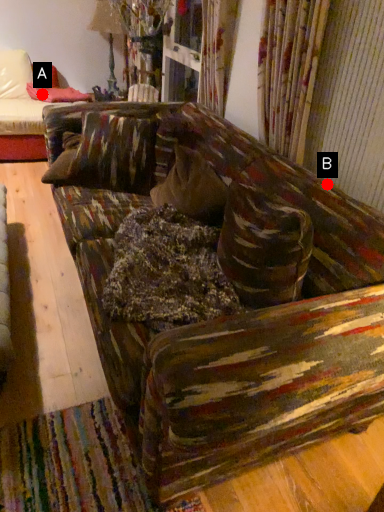
Question: Two points are circled on the image, labeled by A and B beside each circle. Which point appears farthest from the camera in this image?

Choices:
 (A) A is further
 (B) B is further

Answer: (A)